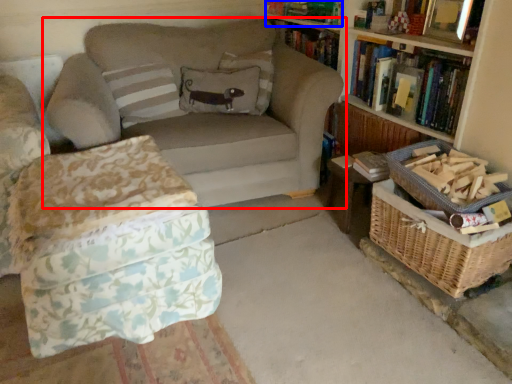
Question: Which object is further to the camera taking this photo, studio couch (highlighted by a red box) or book (highlighted by a blue box)?

Choices:
 (A) studio couch
 (B) book

Answer: (B)